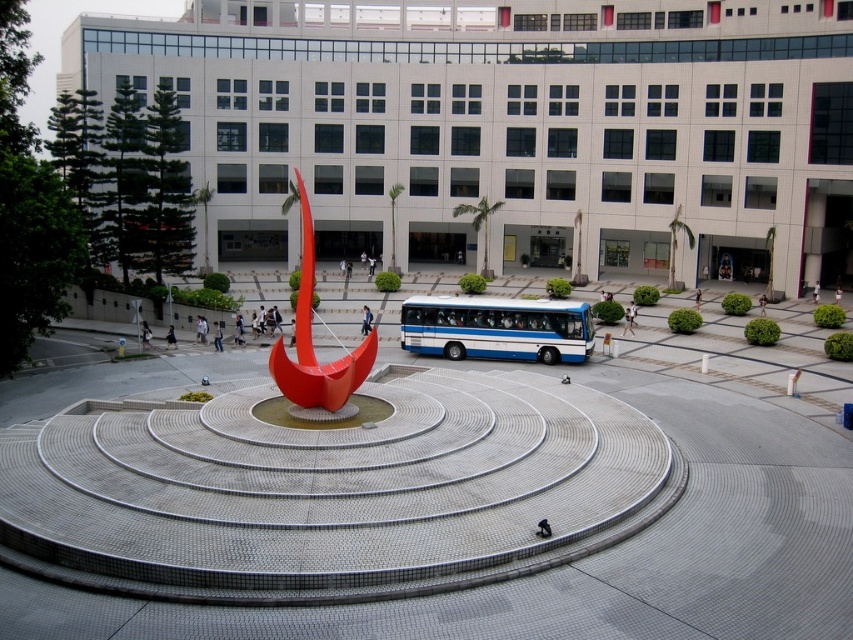
You are standing at the entrance of the building and want to walk towards the point labeled as point (561, 332). As you move forward, will you pass by the point labeled as point (305, 250) before reaching your destination?

Yes, you will pass by point (305, 250) before reaching point (561, 332) because point (561, 332) is in front of point (305, 250).